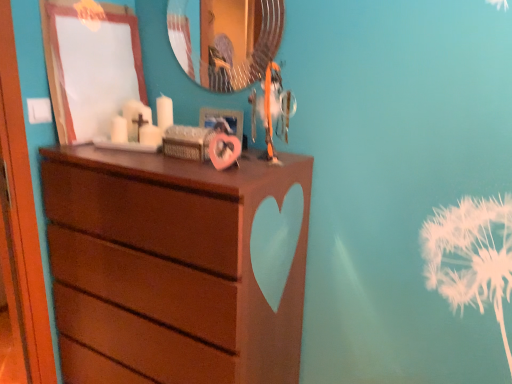
Question: Is matte brown dresser at center oriented towards metallic silver picture frame at upper center, which is the first picture frame from right to left?

Choices:
 (A) yes
 (B) no

Answer: (B)

Question: Considering the relative sizes of matte brown dresser at center and metallic silver picture frame at upper center, the 2th picture frame in the left-to-right sequence, in the image provided, is matte brown dresser at center taller than metallic silver picture frame at upper center, the 2th picture frame in the left-to-right sequence,?

Choices:
 (A) no
 (B) yes

Answer: (B)

Question: Can you confirm if matte brown dresser at center is positioned to the right of metallic silver picture frame at upper center, which is the first picture frame from right to left?

Choices:
 (A) yes
 (B) no

Answer: (B)

Question: From a real-world perspective, is matte brown dresser at center under metallic silver picture frame at upper center, the 2th picture frame in the left-to-right sequence?

Choices:
 (A) yes
 (B) no

Answer: (A)

Question: From a real-world perspective, is matte brown dresser at center on top of metallic silver picture frame at upper center, the 2th picture frame in the left-to-right sequence?

Choices:
 (A) no
 (B) yes

Answer: (A)

Question: Does matte brown dresser at center come behind metallic silver picture frame at upper center, the 2th picture frame in the left-to-right sequence?

Choices:
 (A) yes
 (B) no

Answer: (B)

Question: From the image's perspective, does teal glossy mirror at upper center appear lower than metallic silver picture frame at upper center, which is the first picture frame from right to left?

Choices:
 (A) yes
 (B) no

Answer: (B)

Question: From a real-world perspective, is teal glossy mirror at upper center located beneath metallic silver picture frame at upper center, the 2th picture frame in the left-to-right sequence?

Choices:
 (A) no
 (B) yes

Answer: (A)

Question: Can you confirm if teal glossy mirror at upper center is taller than metallic silver picture frame at upper center, the 2th picture frame in the left-to-right sequence?

Choices:
 (A) yes
 (B) no

Answer: (A)

Question: From a real-world perspective, does teal glossy mirror at upper center stand above metallic silver picture frame at upper center, which is the first picture frame from right to left?

Choices:
 (A) yes
 (B) no

Answer: (A)

Question: From the image's perspective, is teal glossy mirror at upper center located above metallic silver picture frame at upper center, which is the first picture frame from right to left?

Choices:
 (A) yes
 (B) no

Answer: (A)

Question: Is teal glossy mirror at upper center positioned beyond the bounds of metallic silver picture frame at upper center, which is the first picture frame from right to left?

Choices:
 (A) no
 (B) yes

Answer: (B)

Question: From the image's perspective, is teal glossy mirror at upper center below matte white picture frame at upper left, acting as the 2th picture frame starting from the right?

Choices:
 (A) no
 (B) yes

Answer: (A)